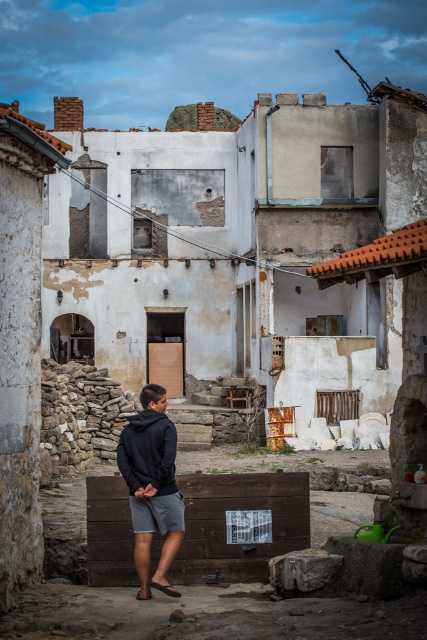
Question: Based on their relative distances, which object is farther from the dark gray hoodie at center?

Choices:
 (A) black rubber sandal at lower center
 (B) black fleece sweatshirt at center
 (C) black leather sandal at lower center

Answer: (A)

Question: Where is brown wooden crate at lower center located in relation to black fleece sweatshirt at center in the image?

Choices:
 (A) below
 (B) above

Answer: (A)

Question: Does dark gray hoodie at center have a greater width compared to black rubber sandal at lower center?

Choices:
 (A) no
 (B) yes

Answer: (B)

Question: Which object appears closest to the camera in this image?

Choices:
 (A) black rubber sandal at lower center
 (B) dark gray hoodie at center

Answer: (B)

Question: Can you confirm if black fleece sweatshirt at center is wider than black rubber sandal at lower center?

Choices:
 (A) no
 (B) yes

Answer: (B)

Question: Among these points, which one is farthest from the camera?

Choices:
 (A) (143, 598)
 (B) (173, 458)

Answer: (B)